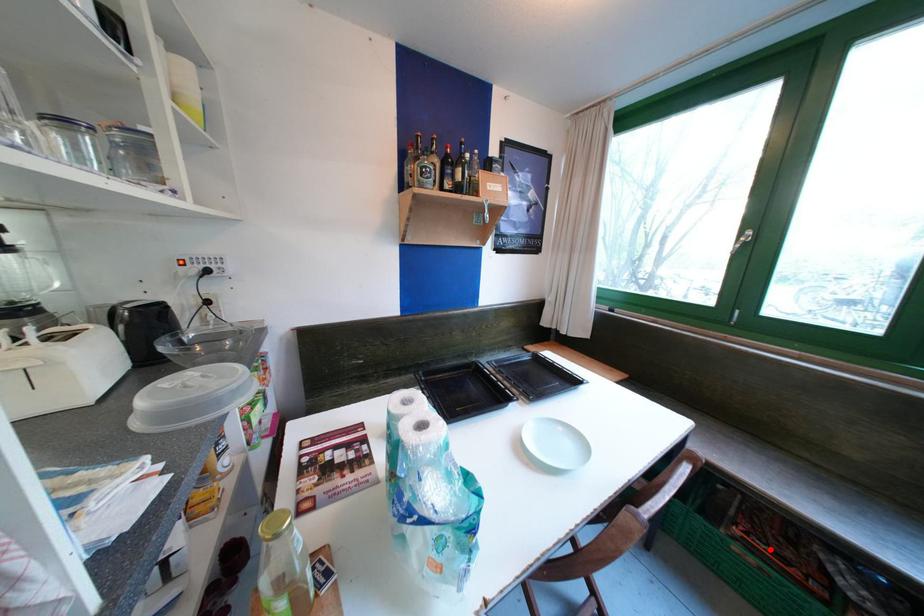
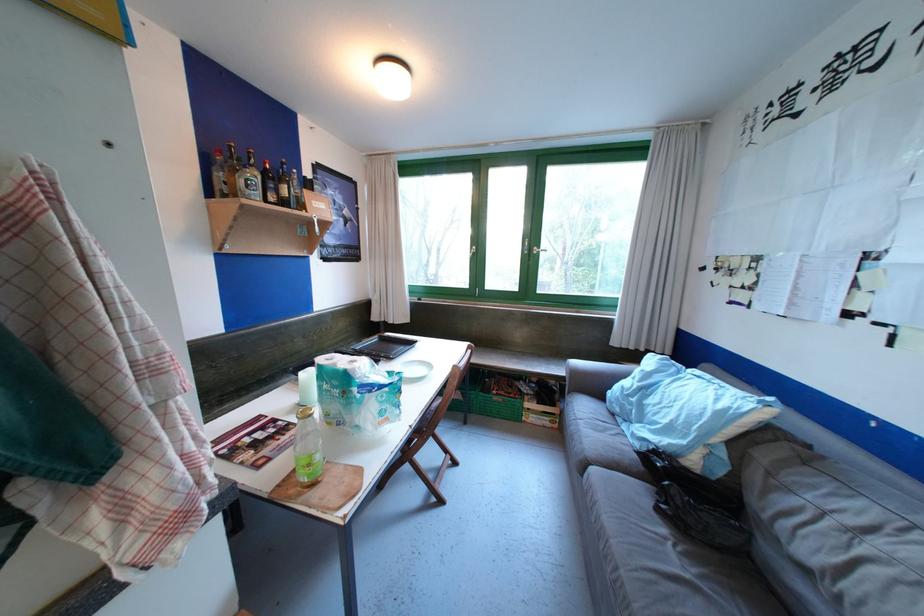
Question: A red point is marked in image1. In image2, is the corresponding 3D point closer to the camera or farther? Reply with the corresponding letter.

Choices:
 (A) The corresponding 3D point is closer.
 (B) The corresponding 3D point is farther.

Answer: (A)